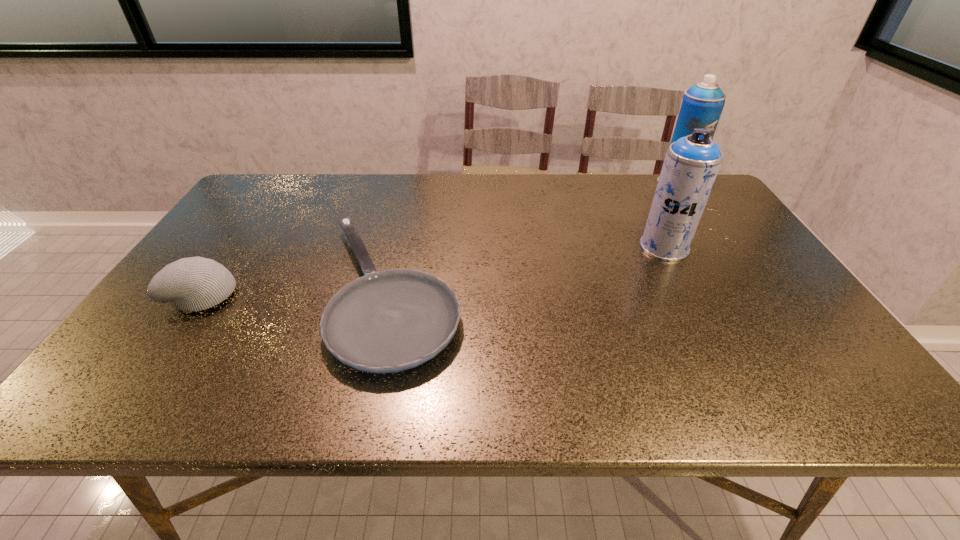
The height and width of the screenshot is (540, 960). I want to click on the right aerosol can, so click(702, 105).

Find the location of a particular element. The image size is (960, 540). the farther aerosol can is located at coordinates (702, 105).

Where is `the nearer aerosol can`? the nearer aerosol can is located at coordinates (691, 164).

This screenshot has width=960, height=540. I want to click on the left aerosol can, so click(691, 164).

You are a GUI agent. You are given a task and a screenshot of the screen. Output one action in this format:
    pyautogui.click(x=<x>, y=<y>)
    Task: Click on the beanie
    
    Given the screenshot: What is the action you would take?
    (x=191, y=284)

Find the location of a particular element. The height and width of the screenshot is (540, 960). the leftmost object is located at coordinates (191, 284).

Find the location of `the shortest object`. the shortest object is located at coordinates tap(388, 321).

The image size is (960, 540). I want to click on the second object from left to right, so click(x=388, y=321).

At what (x,y) coordinates should I click in order to perform the action: click on vacant area located 0.190m on the front of the right aerosol can. Please return your answer as a coordinate pair (x, y). Image resolution: width=960 pixels, height=540 pixels. Looking at the image, I should click on (x=705, y=225).

The height and width of the screenshot is (540, 960). Identify the location of vacant region located on the back of the left aerosol can. (647, 214).